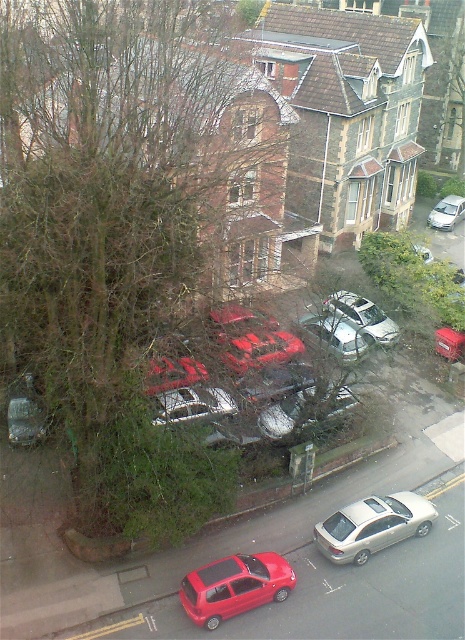
Is shiny red hatchback at lower center closer to camera compared to satin silver sedan at lower center?

Yes, shiny red hatchback at lower center is closer to the viewer.

Identify the location of shiny red hatchback at lower center. The height and width of the screenshot is (640, 465). (234, 586).

Locate an element on the screen. The width and height of the screenshot is (465, 640). shiny red hatchback at lower center is located at coordinates (234, 586).

Between point (0, 20) and point (237, 573), which one is positioned in front?

Point (0, 20) is in front.

Which is more to the right, green leafy tree at upper left or shiny red hatchback at lower center?

From the viewer's perspective, shiny red hatchback at lower center appears more on the right side.

What are the coordinates of `green leafy tree at upper left` in the screenshot? It's located at (113, 236).

The image size is (465, 640). What are the coordinates of `green leafy tree at upper left` in the screenshot? It's located at (113, 236).

Can you confirm if shiny red hatchback at lower center is positioned to the left of satin silver suv at center?

Indeed, shiny red hatchback at lower center is positioned on the left side of satin silver suv at center.

Is point (180, 595) less distant than point (378, 323)?

Yes, point (180, 595) is closer to viewer.

At what (x,y) coordinates should I click in order to perform the action: click on shiny red hatchback at lower center. Please return your answer as a coordinate pair (x, y). The image size is (465, 640). Looking at the image, I should click on (234, 586).